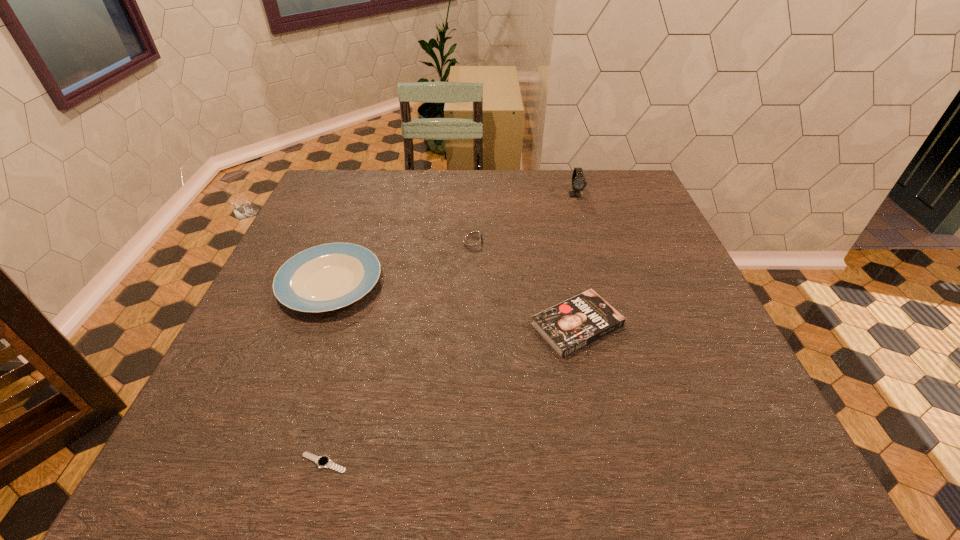
Where is `free spot that satisfies the following two spatial constraints: 1. on the face of the second tallest watch; 2. on the front side of the shortest watch`? This screenshot has width=960, height=540. free spot that satisfies the following two spatial constraints: 1. on the face of the second tallest watch; 2. on the front side of the shortest watch is located at coordinates (469, 463).